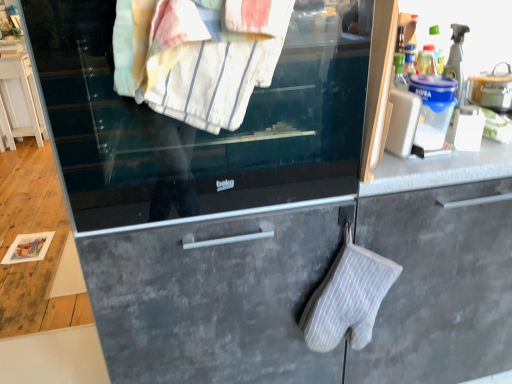
The width and height of the screenshot is (512, 384). What do you see at coordinates (19, 96) in the screenshot?
I see `white glossy cabinet at left` at bounding box center [19, 96].

Image resolution: width=512 pixels, height=384 pixels. Find the location of `white plastic phone at upper right`. white plastic phone at upper right is located at coordinates (402, 122).

Describe the element at coordinates (191, 79) in the screenshot. I see `white striped towel at upper center` at that location.

This screenshot has height=384, width=512. In order to click on white striped oven mitt at lower center in this screenshot , I will do `click(348, 298)`.

In terms of width, does white striped towel at upper center look wider or thinner when compared to white glossy cabinet at left?

Clearly, white striped towel at upper center has less width compared to white glossy cabinet at left.

Would you say white striped towel at upper center is inside or outside white glossy cabinet at left?

white striped towel at upper center exists outside the volume of white glossy cabinet at left.

At what (x,y) coordinates should I click in order to perform the action: click on bath towel behind the white striped towel at upper center. Please return your answer as a coordinate pair (x, y). The image size is (512, 384). Looking at the image, I should click on (348, 298).

From a real-world perspective, which object rests below the other?

white striped oven mitt at lower center.

Who is taller, white striped towel at upper center or white striped oven mitt at lower center?

white striped oven mitt at lower center.

From the picture: Does white striped towel at upper center have a smaller size compared to white striped oven mitt at lower center?

No.

Where is `bath towel on the right of white striped towel at upper center`? bath towel on the right of white striped towel at upper center is located at coordinates (348, 298).

Can we say white striped oven mitt at lower center lies outside white striped towel at upper center?

Indeed, white striped oven mitt at lower center is completely outside white striped towel at upper center.

Consider the image. Which of these two, white striped oven mitt at lower center or white striped towel at upper center, is bigger?

Bigger between the two is white striped towel at upper center.

Consider the image. Which object is closer to the camera taking this photo, clear glass oven door at center or white striped oven mitt at lower center?

clear glass oven door at center is more forward.

Is clear glass oven door at center taller or shorter than white striped oven mitt at lower center?

Clearly, clear glass oven door at center is taller compared to white striped oven mitt at lower center.

Can you see clear glass oven door at center touching white striped oven mitt at lower center?

No, clear glass oven door at center is not next to white striped oven mitt at lower center.

Is clear glass oven door at center placed right next to white glossy cabinet at left?

They are not placed beside each other.

From a real-world perspective, which is physically below, clear glass oven door at center or white glossy cabinet at left?

white glossy cabinet at left.

From the picture: Which of these two, clear glass oven door at center or white glossy cabinet at left, stands shorter?

With less height is clear glass oven door at center.

Considering the points (90, 112) and (4, 114), which point is behind, point (90, 112) or point (4, 114)?

The point (4, 114) is farther.

Where is `appliance below the clear glass oven door at center (from the image's perspective)`? appliance below the clear glass oven door at center (from the image's perspective) is located at coordinates (402, 122).

From a real-world perspective, is clear glass oven door at center physically located above or below white plastic phone at upper right?

In terms of real-world spatial position, clear glass oven door at center is above white plastic phone at upper right.

Is white striped towel at upper center aimed at clear glass oven door at center?

No, white striped towel at upper center is not facing towards clear glass oven door at center.

Between white striped towel at upper center and clear glass oven door at center, which one appears on the left side from the viewer's perspective?

clear glass oven door at center is more to the left.

Can you confirm if white striped towel at upper center is taller than clear glass oven door at center?

No, white striped towel at upper center is not taller than clear glass oven door at center.

From the image's perspective, which object appears higher, white striped towel at upper center or clear glass oven door at center?

clear glass oven door at center is shown above in the image.

At what (x,y) coordinates should I click in order to perform the action: click on person that is above the white glossy cabinet at left (from a real-world perspective). Please return your answer as a coordinate pair (x, y). The image size is (512, 384). Looking at the image, I should click on click(x=191, y=79).

The width and height of the screenshot is (512, 384). I want to click on person that appears on the left of white striped oven mitt at lower center, so click(x=191, y=79).

Based on their spatial positions, is white striped oven mitt at lower center or white striped towel at upper center closer to white glossy cabinet at left?

white striped towel at upper center is closer to white glossy cabinet at left.

Estimate the real-world distances between objects in this image. Which object is further from white striped towel at upper center, white glossy cabinet at left or white plastic phone at upper right?

The object further to white striped towel at upper center is white glossy cabinet at left.

Looking at the image, which one is located further to clear glass oven door at center, white striped oven mitt at lower center or white striped towel at upper center?

white striped oven mitt at lower center lies further to clear glass oven door at center than the other object.

Considering their positions, is clear glass oven door at center positioned further to white striped towel at upper center than white plastic phone at upper right?

white plastic phone at upper right lies further to white striped towel at upper center than the other object.

Estimate the real-world distances between objects in this image. Which object is further from white glossy cabinet at left, white plastic phone at upper right or clear glass oven door at center?

white plastic phone at upper right is positioned further to the anchor white glossy cabinet at left.

Looking at the image, which one is located closer to clear glass oven door at center, white glossy cabinet at left or white striped oven mitt at lower center?

Based on the image, white striped oven mitt at lower center appears to be nearer to clear glass oven door at center.

Looking at the image, which one is located closer to white glossy cabinet at left, clear glass oven door at center or white plastic phone at upper right?

clear glass oven door at center is positioned closer to the anchor white glossy cabinet at left.

Looking at the image, which one is located closer to white striped towel at upper center, clear glass oven door at center or white glossy cabinet at left?

Among the two, clear glass oven door at center is located nearer to white striped towel at upper center.

You are a GUI agent. You are given a task and a screenshot of the screen. Output one action in this format:
    pyautogui.click(x=<x>, y=<y>)
    Task: Click on the person between clear glass oven door at center and white striped oven mitt at lower center vertically
    Image resolution: width=512 pixels, height=384 pixels.
    Given the screenshot: What is the action you would take?
    pyautogui.click(x=191, y=79)

You are a GUI agent. You are given a task and a screenshot of the screen. Output one action in this format:
    pyautogui.click(x=<x>, y=<y>)
    Task: Click on the bath towel between white striped towel at upper center and white glossy cabinet at left in the front-back direction
    Image resolution: width=512 pixels, height=384 pixels.
    Given the screenshot: What is the action you would take?
    pyautogui.click(x=348, y=298)

Find the location of a particular element. The height and width of the screenshot is (384, 512). appliance between clear glass oven door at center and white glossy cabinet at left along the z-axis is located at coordinates (402, 122).

At what (x,y) coordinates should I click in order to perform the action: click on person between white plastic phone at upper right and white striped oven mitt at lower center from top to bottom. Please return your answer as a coordinate pair (x, y). The width and height of the screenshot is (512, 384). Looking at the image, I should click on (191, 79).